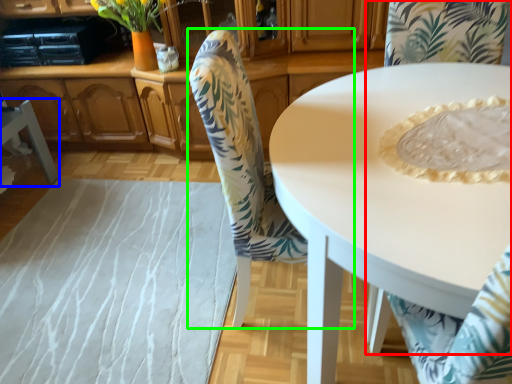
Question: Considering the real-world distances, which object is farthest from chair (highlighted by a red box)? chair (highlighted by a blue box) or chair (highlighted by a green box)?

Choices:
 (A) chair
 (B) chair

Answer: (A)